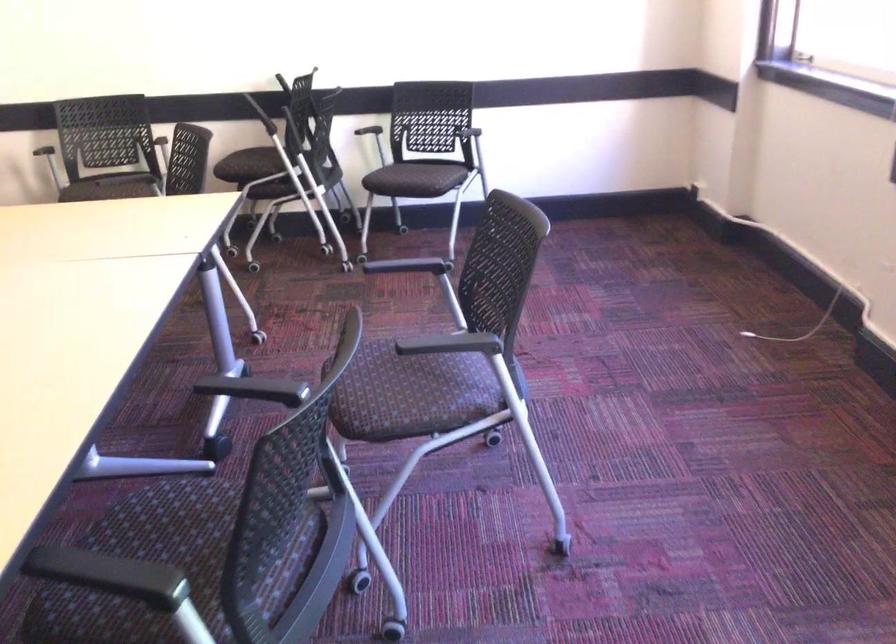
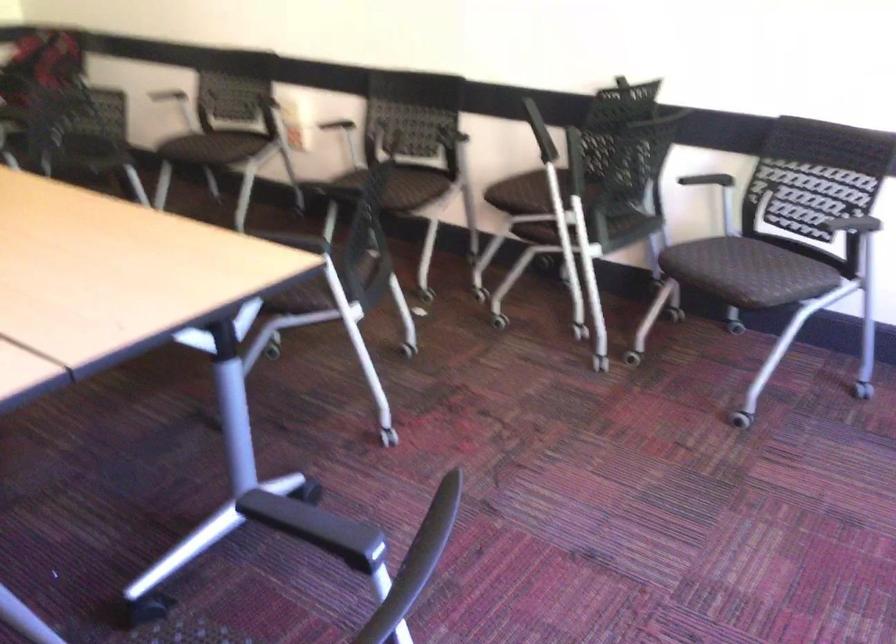
Locate, in the second image, the point that corresponds to the point at 431,167 in the first image.

(764, 272)